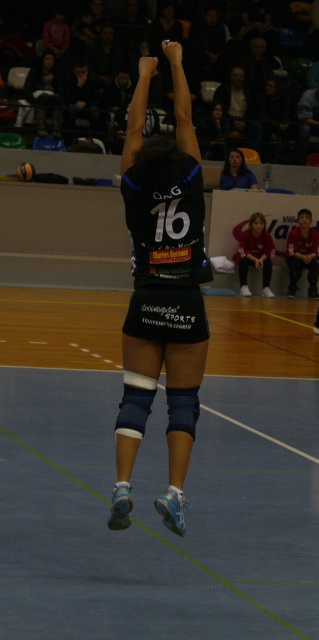
Question: Which point appears farthest from the camera in this image?

Choices:
 (A) (244, 280)
 (B) (21, 164)

Answer: (B)

Question: From the image, what is the correct spatial relationship of smooth skin face at upper center in relation to yellow rubber volleyball at center?

Choices:
 (A) right
 (B) left

Answer: (A)

Question: Is smooth skin face at upper center bigger than yellow rubber volleyball at center?

Choices:
 (A) yes
 (B) no

Answer: (A)

Question: Which object is farther from the camera taking this photo?

Choices:
 (A) smooth skin face at upper center
 (B) matte red shirt at center
 (C) black matte uniform at center
 (D) yellow rubber volleyball at center

Answer: (A)

Question: Observing the image, what is the correct spatial positioning of black matte uniform at center in reference to yellow rubber volleyball at center?

Choices:
 (A) below
 (B) above

Answer: (A)

Question: Which point is farther to the camera?

Choices:
 (A) matte red shirt at center
 (B) yellow rubber volleyball at center

Answer: (B)